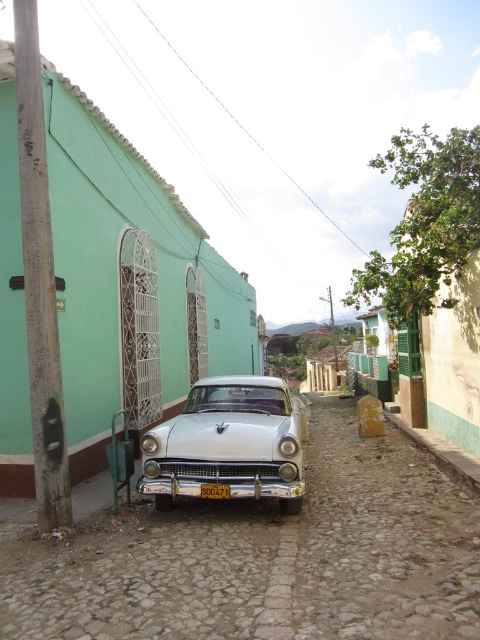
You are a delivery person trying to park a new car that is exactly the same size as the white glossy car at center. The parking spot is at coordinates 0.694, 0.475. Can you safely park your car there without overlapping any other objects?

The white glossy car at center is already located at point (228,444), so you cannot park your car there without overlapping it.

You are a delivery driver who needs to park a delivery van that is 2 meters wide. You see a metallic silver car at center and a white glossy car at center parked on the street. Can you determine if there is enough space between them to park your van?

The metallic silver car at center might be wider than white glossy car at center, so there may not be enough space between them to park a van that is 2 meters wide. Check the actual width before deciding.